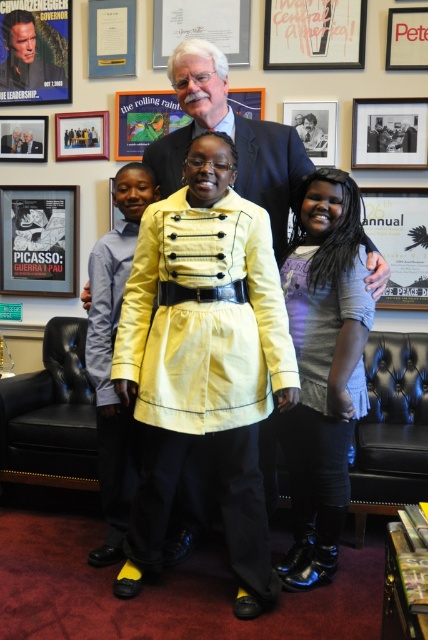
Question: Can you confirm if metallic silver annual at upper center is bigger than brushed metal picture frame at upper center?

Choices:
 (A) no
 (B) yes

Answer: (B)

Question: Can you confirm if metallic silver annual at upper center is wider than wooden picture frame at upper center?

Choices:
 (A) no
 (B) yes

Answer: (B)

Question: Which of the following is the closest to the observer?

Choices:
 (A) yellow fabric jacket at center
 (B) metallic silver annual at upper center
 (C) metallic poster at upper left
 (D) matte black poster at left

Answer: (A)

Question: Among these points, which one is farthest from the camera?

Choices:
 (A) (103, 134)
 (B) (297, 310)

Answer: (A)

Question: Which of these objects is positioned closest to the wooden picture frame at upper center?

Choices:
 (A) denim dress at lower right
 (B) black matte picture frame at upper center
 (C) metallic poster at upper center

Answer: (B)

Question: Does matte black poster at left appear under metallic silver annual at upper center?

Choices:
 (A) yes
 (B) no

Answer: (B)